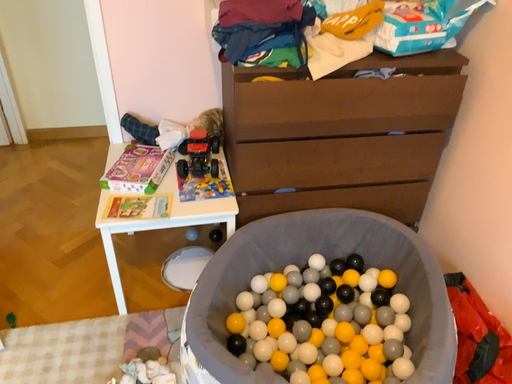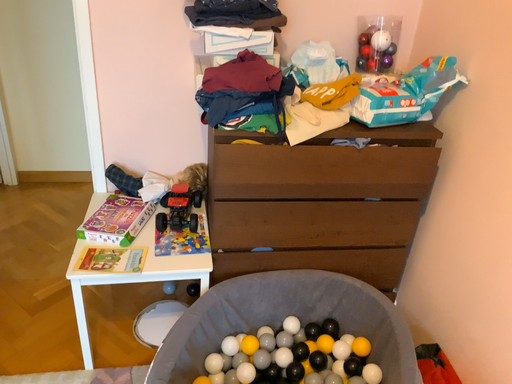
Question: Which way did the camera rotate in the video?

Choices:
 (A) rotated upward
 (B) rotated downward

Answer: (A)